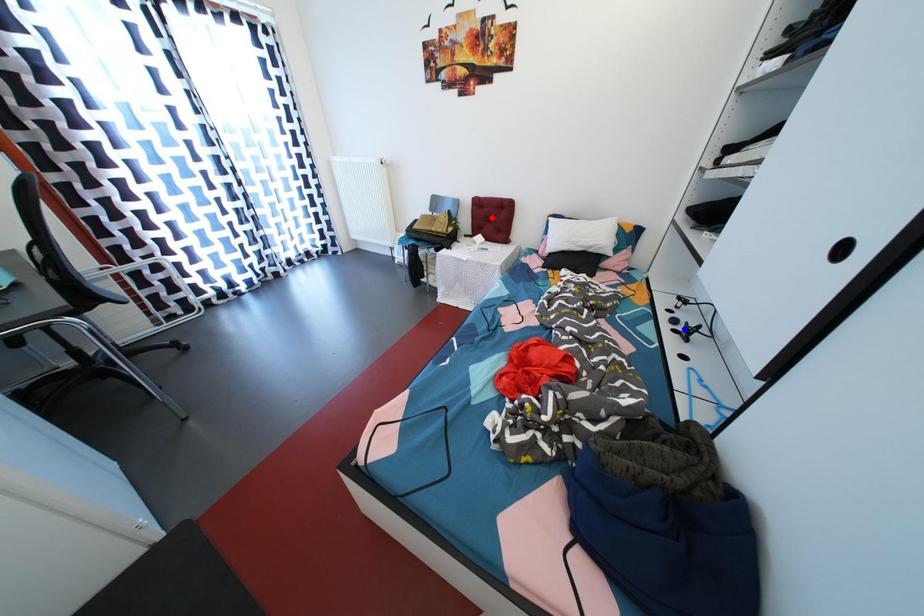
Question: Two points are marked on the image. Which point is closer to the camera?

Choices:
 (A) Blue point is closer.
 (B) Red point is closer.

Answer: (A)